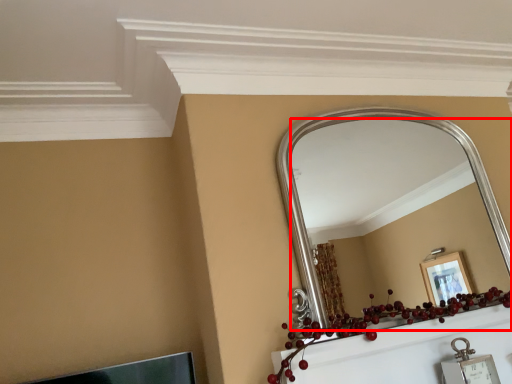
Question: Where is mirror (annotated by the red box) located in relation to christmas decoration in the image?

Choices:
 (A) left
 (B) right

Answer: (B)